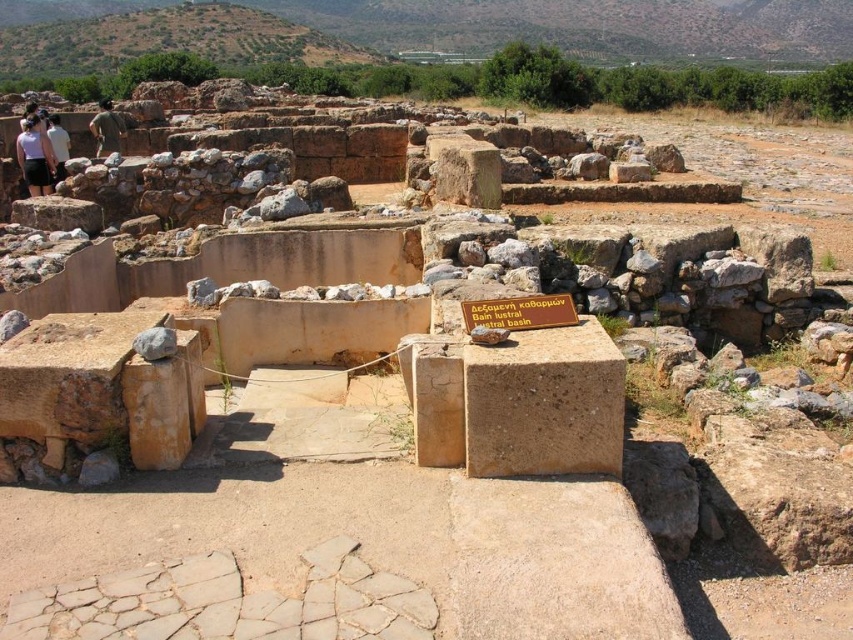
Question: Estimate the real-world distances between objects in this image. Which object is farther from the green fabric shirt at upper left?

Choices:
 (A) white cotton shirt at upper left
 (B) matte white shirt at left
 (C) brown stone sign at center

Answer: (C)

Question: Based on their relative distances, which object is nearer to the matte white shirt at left?

Choices:
 (A) brown stone sign at center
 (B) green fabric shirt at upper left
 (C) white cotton shirt at upper left

Answer: (C)

Question: Where is green fabric shirt at upper left located in relation to white cotton shirt at upper left in the image?

Choices:
 (A) right
 (B) left

Answer: (B)

Question: Can you confirm if brown stone sign at center is positioned to the left of white cotton shirt at upper left?

Choices:
 (A) no
 (B) yes

Answer: (A)

Question: Is matte white shirt at left in front of white cotton shirt at upper left?

Choices:
 (A) yes
 (B) no

Answer: (A)

Question: Which of the following is the closest to the observer?

Choices:
 (A) brown stone sign at center
 (B) white cotton shirt at upper left
 (C) green fabric shirt at upper left

Answer: (A)